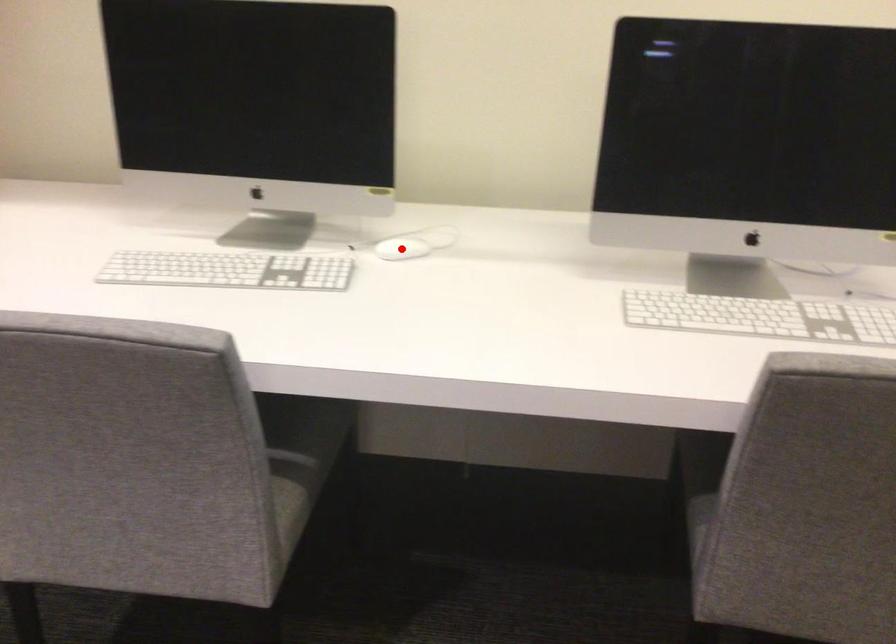
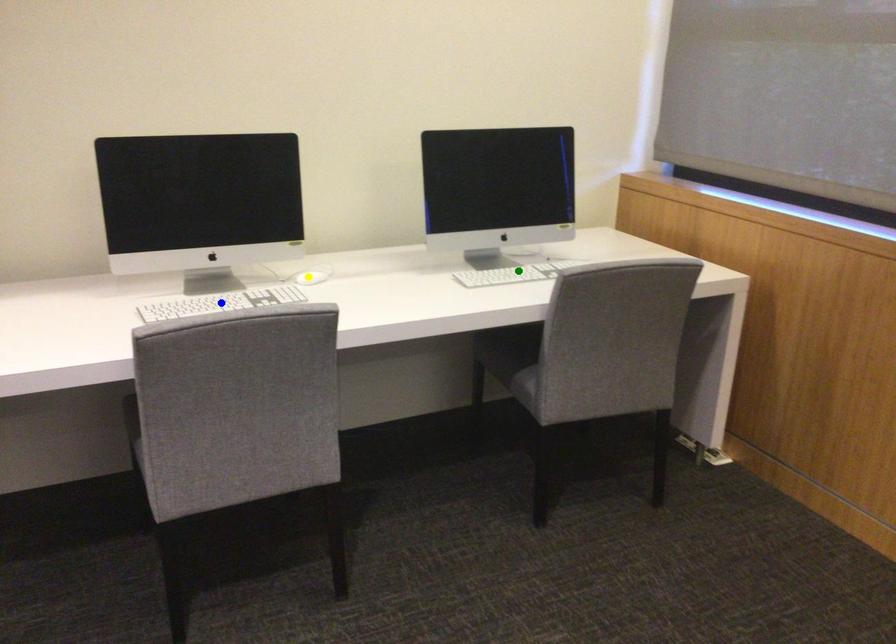
Question: I am providing you with two images of the same scene from different viewpoints. A red point is marked on the first image. You are given multiple points on the second image. Which point in image 2 represents the same 3d spot as the red point in image 1?

Choices:
 (A) yellow point
 (B) blue point
 (C) green point

Answer: (A)